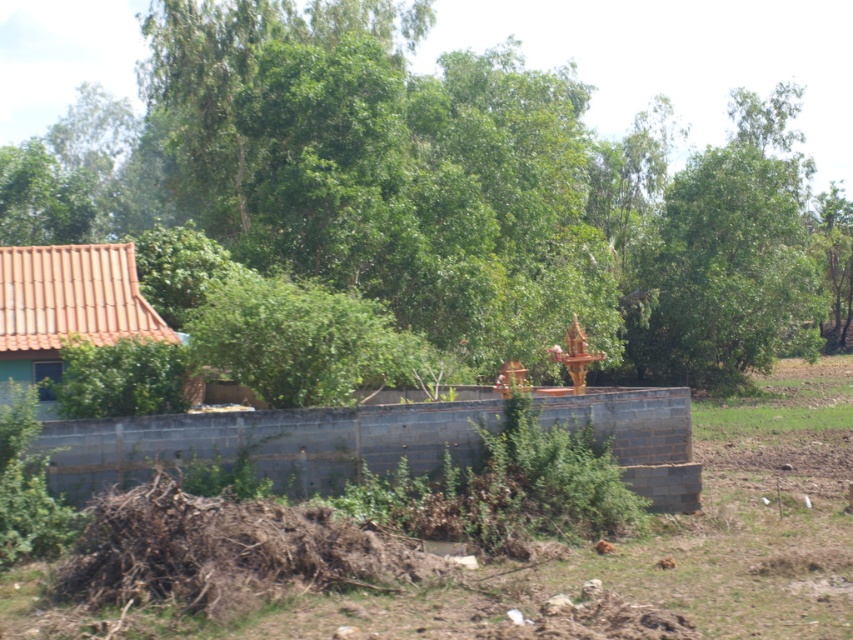
You are standing in the rural scene and want to take a photo of the green leafy tree at center. If your camera can focus on objects up to 20 meters away, will you need to adjust your position to capture the tree clearly?

The green leafy tree at center is 20.10 meters from the viewer. Since the camera can focus up to 20 meters, you need to move closer by at least 0.10 meters to ensure clear focus.

You are standing at the point marked by the coordinate point at (457, 192) in the image. Looking around, you see a small mound of earth or debris near the center left. Which direction should you face to see the green leafy tree at center?

The point at (457, 192) is where the green leafy tree at center is located, so you are already facing it.

You are standing in the rural scene and want to place a small flag at each of the two points marked as point (401, 221) and point (390, 612). Which point is closer to you so that you can reach it without moving further back?

Point (401, 221) is further to the camera than point (390, 612), so the point closer to you is point (390, 612). Therefore, you can reach point (390, 612) without moving further back.